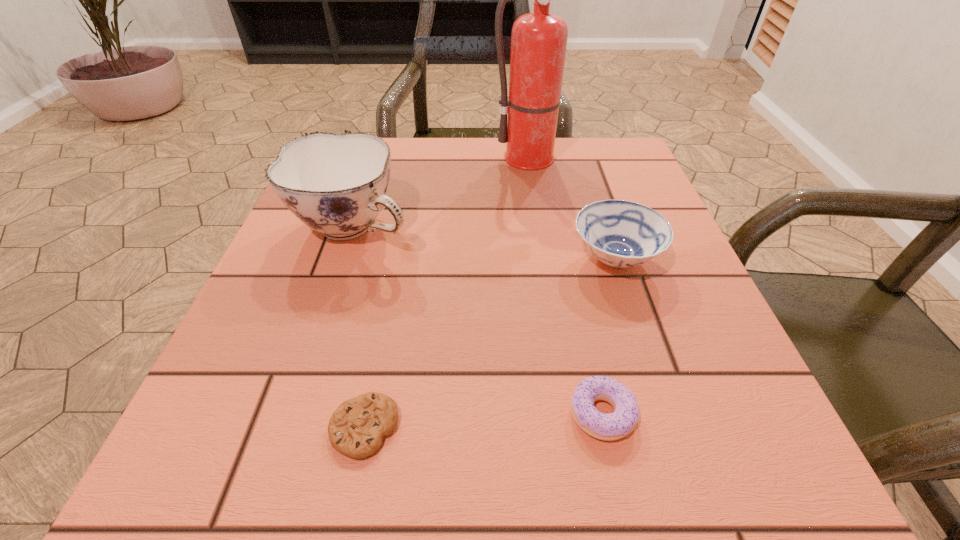
Find the location of a particular element. vacant position at the right edge of the desktop is located at coordinates (689, 375).

Image resolution: width=960 pixels, height=540 pixels. In the image, there is a desktop. What are the coordinates of `vacant space at the far right corner` in the screenshot? It's located at (575, 143).

In the image, there is a desktop. At what (x,y) coordinates should I click in order to perform the action: click on vacant space at the near right corner. Please return your answer as a coordinate pair (x, y). The image size is (960, 540). Looking at the image, I should click on (705, 487).

This screenshot has width=960, height=540. What are the coordinates of `empty location between the second tallest object and the tallest object` in the screenshot? It's located at (445, 192).

Where is `free space between the tallest object and the third shortest object`? free space between the tallest object and the third shortest object is located at coordinates (576, 208).

Locate an element on the screen. free space that is in between the farthest object and the cookie is located at coordinates (450, 293).

Image resolution: width=960 pixels, height=540 pixels. In order to click on vacant area that lies between the shortest object and the soup bowl in this screenshot , I will do `click(490, 343)`.

At what (x,y) coordinates should I click in order to perform the action: click on free space between the shortest object and the second shortest object. Please return your answer as a coordinate pair (x, y). Image resolution: width=960 pixels, height=540 pixels. Looking at the image, I should click on point(483,421).

Image resolution: width=960 pixels, height=540 pixels. I want to click on free point between the tallest object and the chinaware, so click(x=445, y=192).

I want to click on free area in between the second shortest object and the tallest object, so click(569, 286).